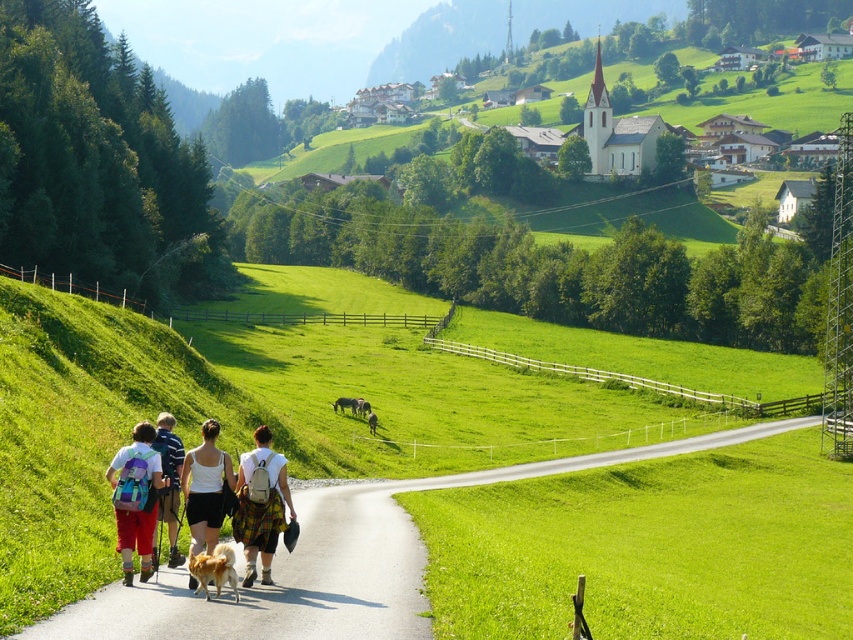
Is the position of smooth asphalt road at center less distant than that of white cotton tank top at center?

That is True.

At what (x,y) coordinates should I click in order to perform the action: click on smooth asphalt road at center. Please return your answer as a coordinate pair (x, y). This screenshot has height=640, width=853. Looking at the image, I should click on (334, 564).

This screenshot has width=853, height=640. Identify the location of smooth asphalt road at center. (334, 564).

Does white fabric skirt at center have a lesser width compared to white cotton tank top at center?

Yes.

Is point (260, 451) in front of point (199, 468)?

Yes, point (260, 451) is in front of point (199, 468).

At what (x,y) coordinates should I click in order to perform the action: click on white fabric skirt at center. Please return your answer as a coordinate pair (x, y). Looking at the image, I should click on (260, 506).

Is matte purple backpack at center below white cotton tank top at center?

Yes, matte purple backpack at center is below white cotton tank top at center.

Is point (131, 529) closer to camera compared to point (225, 460)?

Yes, it is in front of point (225, 460).

Measure the distance between point [122,538] and camera.

They are 49.48 feet apart.

Locate an element on the screen. matte purple backpack at center is located at coordinates (135, 499).